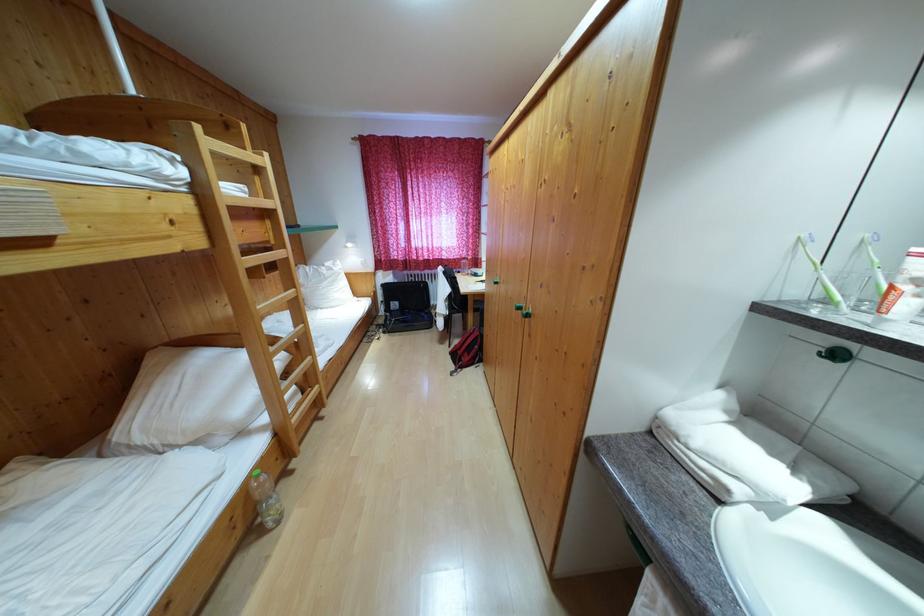
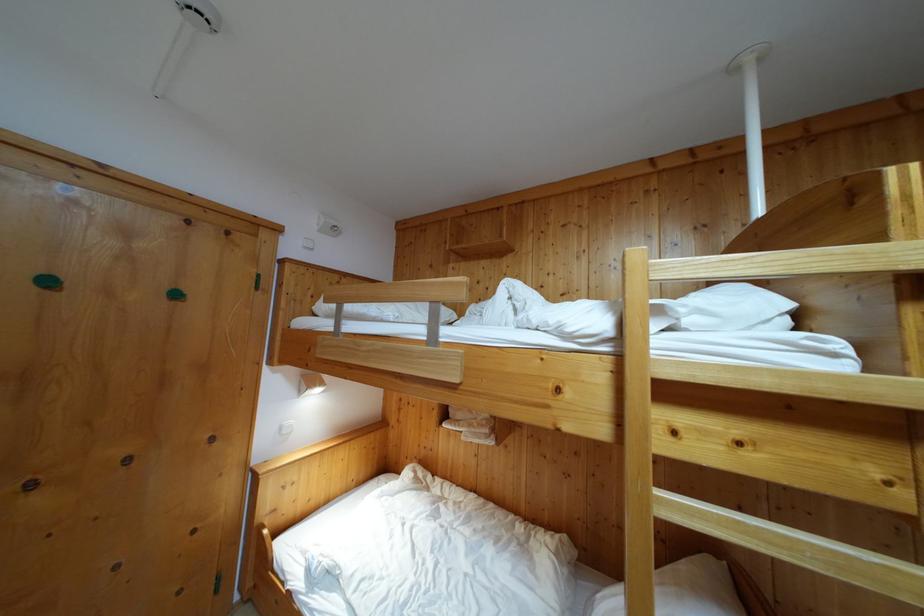
Where in the second image is the point corresponding to the point at 248,156 from the first image?

(881, 245)